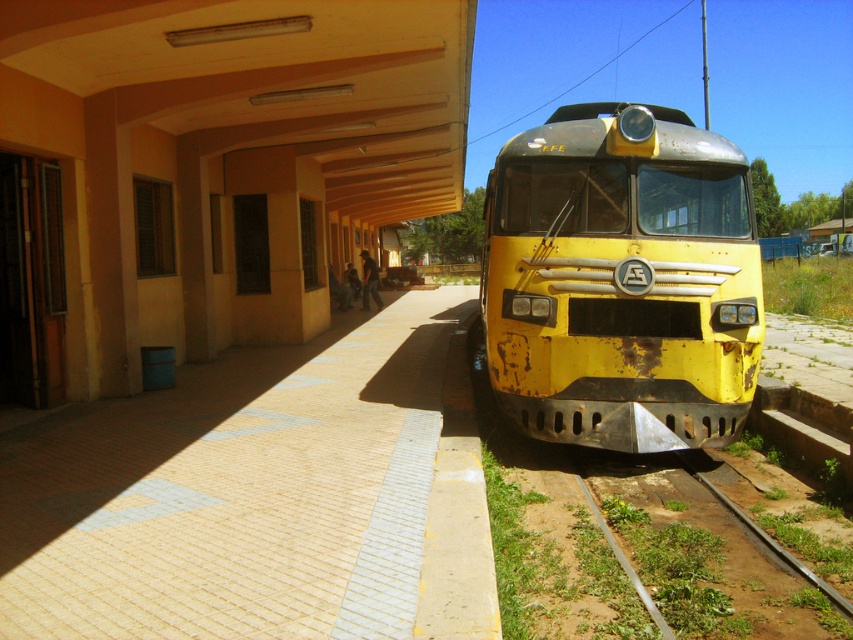
Between brick pavement at center and yellow matte train at center, which one is positioned lower?

brick pavement at center

The width and height of the screenshot is (853, 640). Describe the element at coordinates (236, 492) in the screenshot. I see `brick pavement at center` at that location.

Is point (155, 628) positioned behind point (497, 243)?

No, it is in front of (497, 243).

At what (x,y) coordinates should I click in order to perform the action: click on brick pavement at center. Please return your answer as a coordinate pair (x, y). The width and height of the screenshot is (853, 640). Looking at the image, I should click on (236, 492).

Who is lower down, brick pavement at center or green grassy track at lower right?

green grassy track at lower right

Is brick pavement at center below green grassy track at lower right?

No.

This screenshot has height=640, width=853. Identify the location of brick pavement at center. (236, 492).

Is point (531, 225) less distant than point (605, 493)?

No, it is not.

I want to click on yellow matte train at center, so click(621, 280).